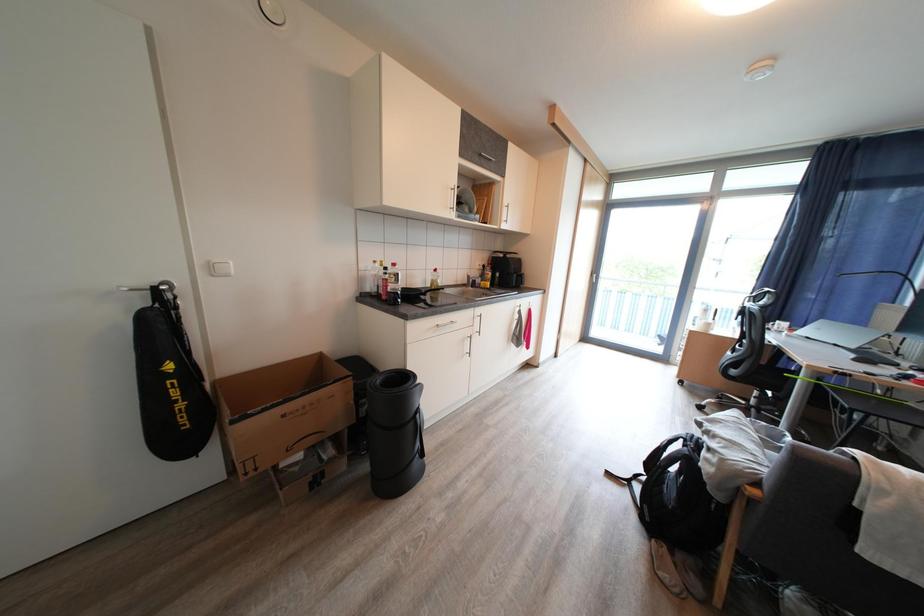
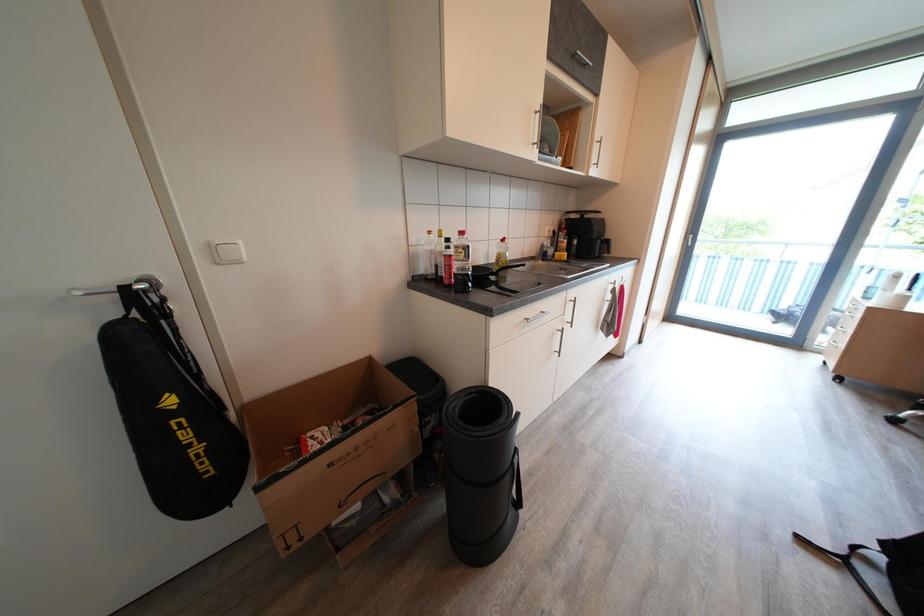
Question: The camera is either moving clockwise (left) or counter-clockwise (right) around the object. The first image is from the beginning of the video and the second image is from the end. Is the camera moving left or right when shooting the video?

Choices:
 (A) Left
 (B) Right

Answer: (B)